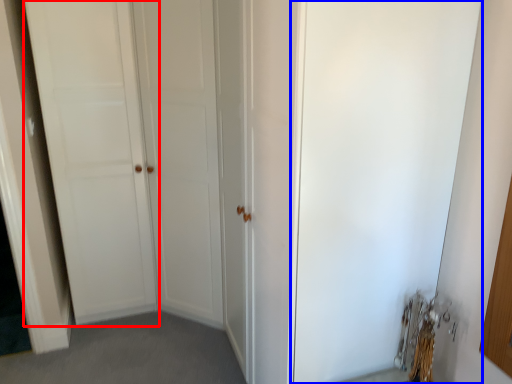
Question: Which of the following is the farthest to the observer, door (highlighted by a red box) or screen door (highlighted by a blue box)?

Choices:
 (A) door
 (B) screen door

Answer: (A)